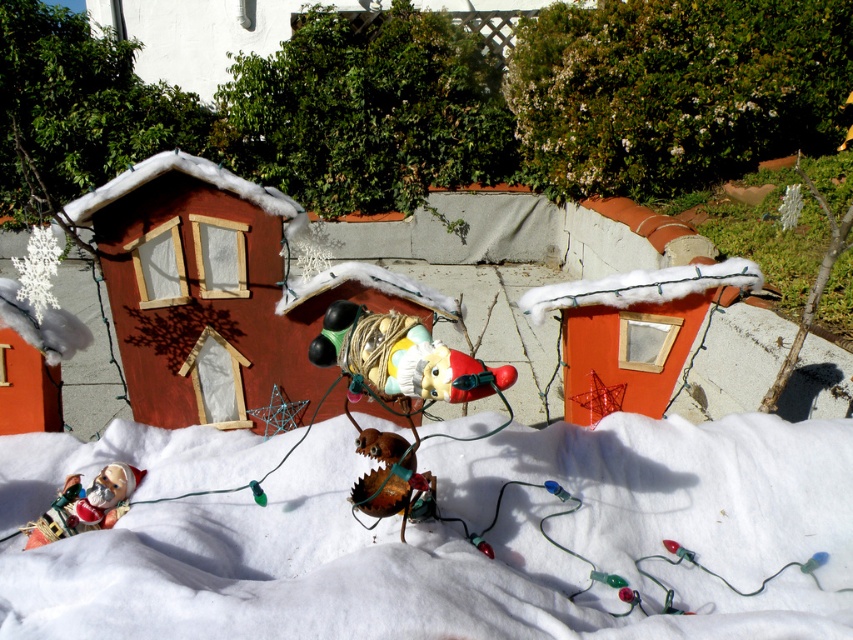
Question: Which point is closer to the camera taking this photo?

Choices:
 (A) (93, 621)
 (B) (33, 536)

Answer: (A)

Question: Which of the following is the closest to the observer?

Choices:
 (A) white fluffy snow at center
 (B) matte plastic toy at lower left

Answer: (A)

Question: Can you confirm if white fluffy snow at center is positioned below matte plastic toy at lower left?

Choices:
 (A) no
 (B) yes

Answer: (B)

Question: Is white fluffy snow at center bigger than matte plastic toy at lower left?

Choices:
 (A) yes
 (B) no

Answer: (A)

Question: Is white fluffy snow at center positioned at the back of matte plastic toy at lower left?

Choices:
 (A) yes
 (B) no

Answer: (B)

Question: Which point is farther to the camera?

Choices:
 (A) (50, 531)
 (B) (222, 573)

Answer: (A)